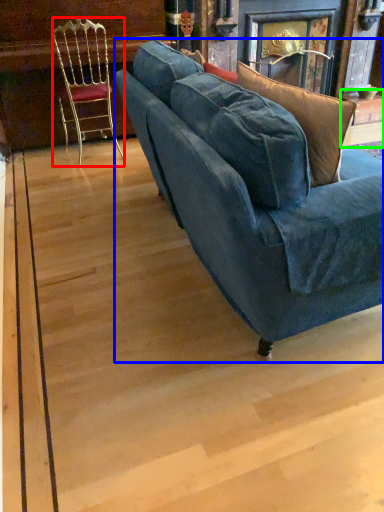
Question: Which is nearer to the chair (highlighted by a red box)? studio couch (highlighted by a blue box) or table (highlighted by a green box).

Choices:
 (A) studio couch
 (B) table

Answer: (A)